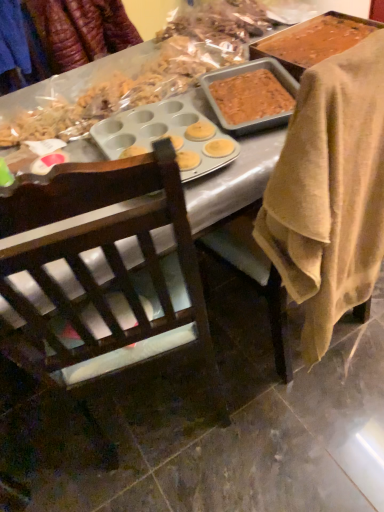
Question: Considering the relative sizes of dark wood chair at center, arranged as the first chair when viewed from the left, and blue fabric at upper left in the image provided, is dark wood chair at center, arranged as the first chair when viewed from the left, wider than blue fabric at upper left?

Choices:
 (A) no
 (B) yes

Answer: (B)

Question: Is dark wood chair at center, which is counted as the 2th chair, starting from the right, positioned beyond the bounds of blue fabric at upper left?

Choices:
 (A) no
 (B) yes

Answer: (B)

Question: Does dark wood chair at center, which is counted as the 2th chair, starting from the right, appear on the right side of blue fabric at upper left?

Choices:
 (A) no
 (B) yes

Answer: (B)

Question: From a real-world perspective, is dark wood chair at center, which is counted as the 2th chair, starting from the right, positioned under blue fabric at upper left based on gravity?

Choices:
 (A) no
 (B) yes

Answer: (B)

Question: Can you confirm if dark wood chair at center, arranged as the first chair when viewed from the left, is bigger than blue fabric at upper left?

Choices:
 (A) no
 (B) yes

Answer: (B)

Question: In terms of width, does brown wooden chair at center, which is counted as the second chair, starting from the left, look wider or thinner when compared to blue fabric at upper left?

Choices:
 (A) thin
 (B) wide

Answer: (B)

Question: From the image's perspective, is brown wooden chair at center, marked as the first chair in a right-to-left arrangement, above or below blue fabric at upper left?

Choices:
 (A) above
 (B) below

Answer: (B)

Question: In the image, is brown wooden chair at center, marked as the first chair in a right-to-left arrangement, on the left side or the right side of blue fabric at upper left?

Choices:
 (A) right
 (B) left

Answer: (A)

Question: In terms of size, does brown wooden chair at center, which is counted as the second chair, starting from the left, appear bigger or smaller than blue fabric at upper left?

Choices:
 (A) small
 (B) big

Answer: (B)

Question: Would you say dark wood chair at center, which is counted as the 2th chair, starting from the right, is to the left or to the right of blue fabric at upper left in the picture?

Choices:
 (A) right
 (B) left

Answer: (A)

Question: Is point (96, 243) positioned closer to the camera than point (0, 52)?

Choices:
 (A) closer
 (B) farther

Answer: (A)

Question: In the image, is dark wood chair at center, arranged as the first chair when viewed from the left, positioned in front of or behind blue fabric at upper left?

Choices:
 (A) front
 (B) behind

Answer: (A)

Question: Is dark wood chair at center, which is counted as the 2th chair, starting from the right, taller or shorter than blue fabric at upper left?

Choices:
 (A) tall
 (B) short

Answer: (A)

Question: Does point (94, 162) appear closer or farther from the camera than point (321, 81)?

Choices:
 (A) farther
 (B) closer

Answer: (A)

Question: Is dark wood chair at center, which is counted as the 2th chair, starting from the right, spatially inside brown wooden chair at center, which is counted as the second chair, starting from the left, or outside of it?

Choices:
 (A) outside
 (B) inside

Answer: (A)